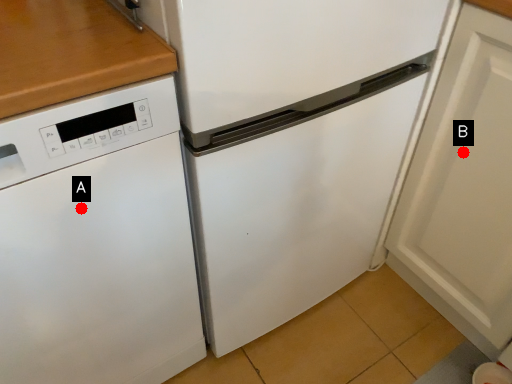
Question: Two points are circled on the image, labeled by A and B beside each circle. Which point is closer to the camera?

Choices:
 (A) A is closer
 (B) B is closer

Answer: (A)